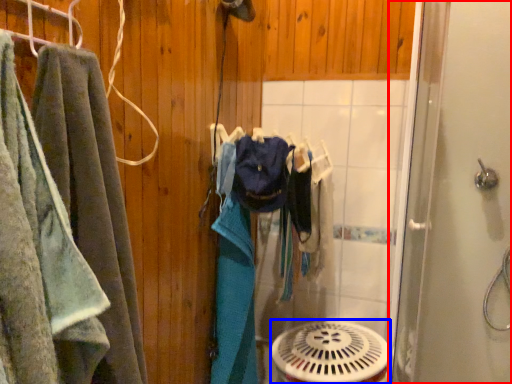
Question: Among these objects, which one is nearest to the camera, screen door (highlighted by a red box) or mechanical fan (highlighted by a blue box)?

Choices:
 (A) screen door
 (B) mechanical fan

Answer: (A)